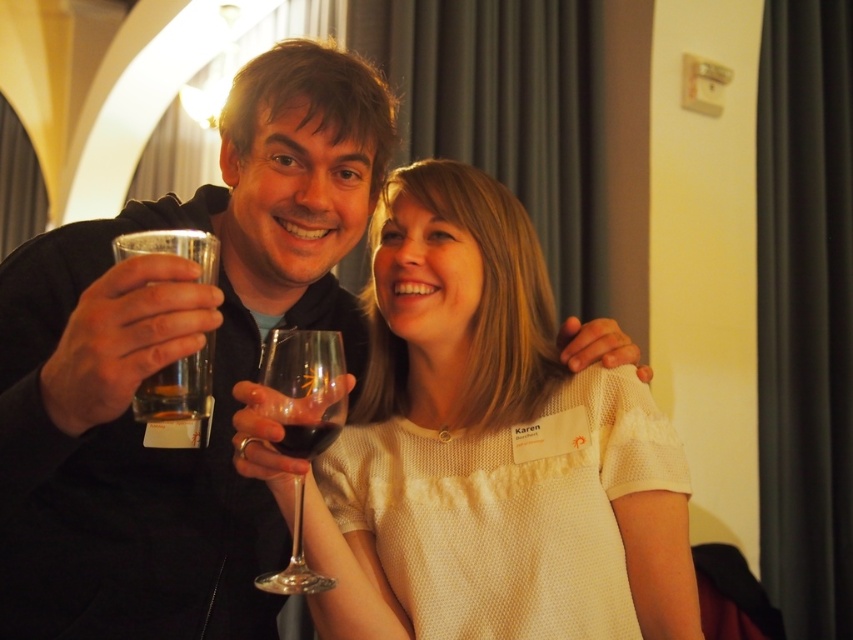
You are holding a 12.00 inch ruler. You want to measure the distance between yourself and the transparent glass at center. Can you use the ruler to measure this distance?

The transparent glass at center and viewer are 29.00 inches apart. Since the ruler is 12.00 inches long, you can use it to measure the distance by extending it multiple times or marking intervals until reaching the total distance of 29.00 inches.

You are a photographer adjusting the camera focus. You notice the clear glass at upper left and the translucent glass at center in the frame. Which glass should you focus on first if you want to ensure both are in focus?

You should focus on the clear glass at upper left first because it is in front of the translucent glass at center. By focusing on the closer object, you can ensure both are in focus if your depth of field is sufficient.

Looking at this image, you are a photographer adjusting your camera settings to focus on the transparent glass at center and the clear glass at upper left. Which glass should you focus on first to ensure both are in sharp focus?

You should focus on the transparent glass at center first because it is closer to the viewer than the clear glass at upper left, ensuring both are in focus when starting from the nearest object.